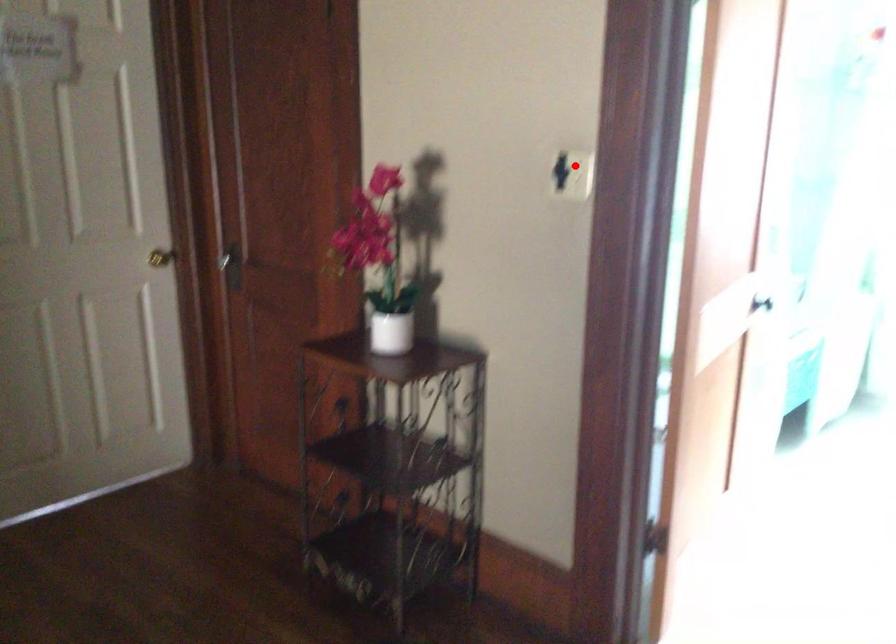
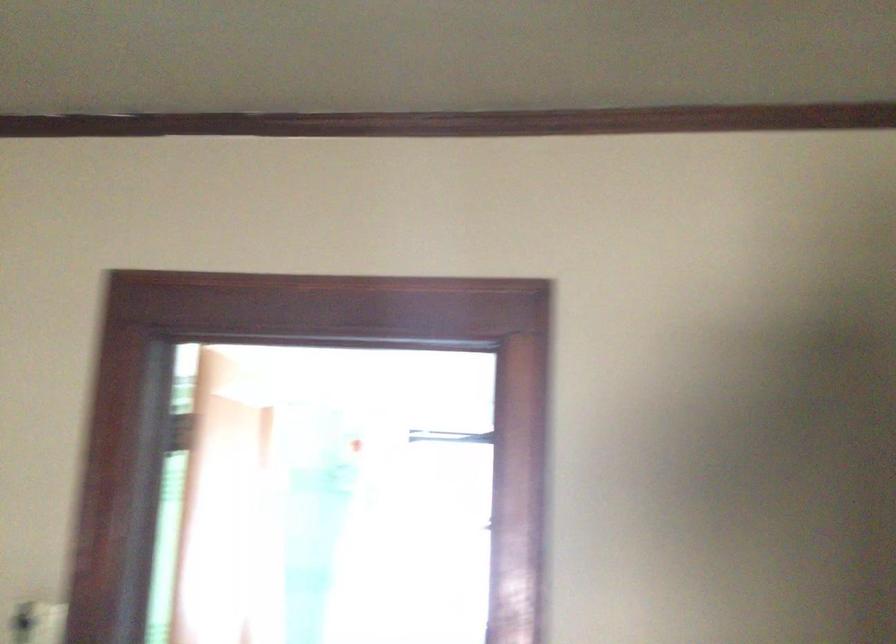
Locate, in the second image, the point that corresponds to the highlighted location in the first image.

(36, 623)